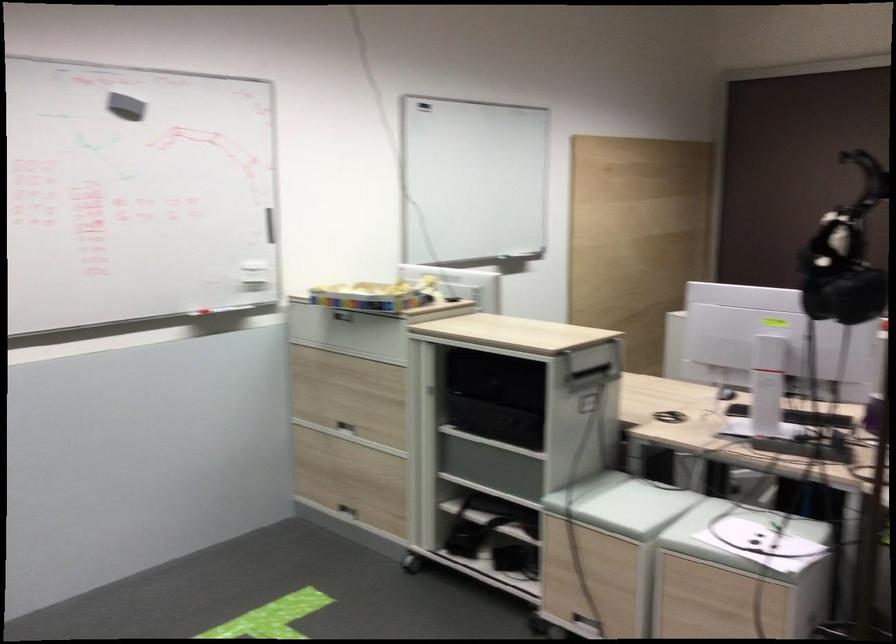
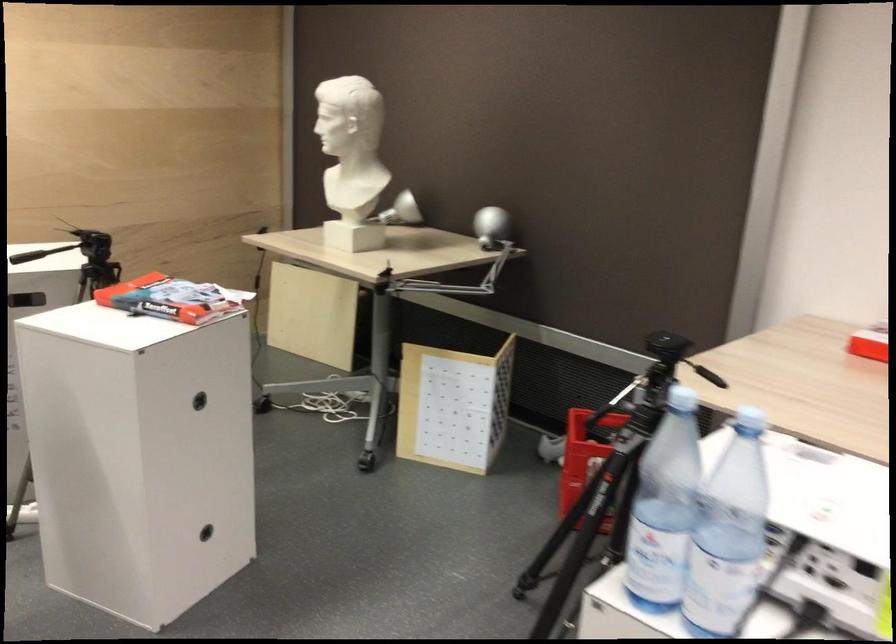
In a continuous first-person perspective shot, in which direction is the camera moving?

The movement direction of the cameraman is right, forward.